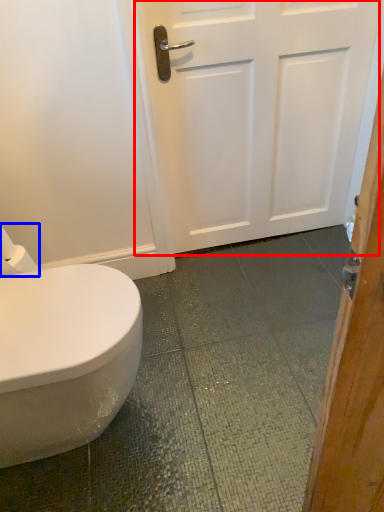
Question: Among these objects, which one is farthest to the camera, door (highlighted by a red box) or toilet paper (highlighted by a blue box)?

Choices:
 (A) door
 (B) toilet paper

Answer: (A)